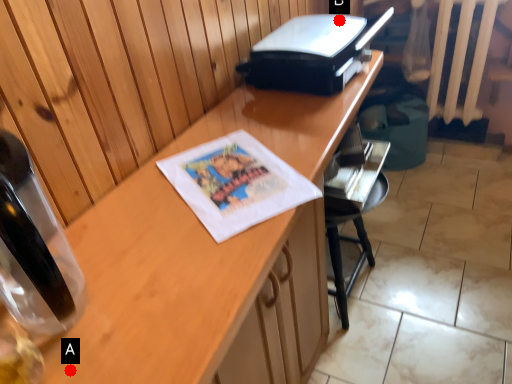
Question: Two points are circled on the image, labeled by A and B beside each circle. Which point is further to the camera?

Choices:
 (A) A is further
 (B) B is further

Answer: (B)